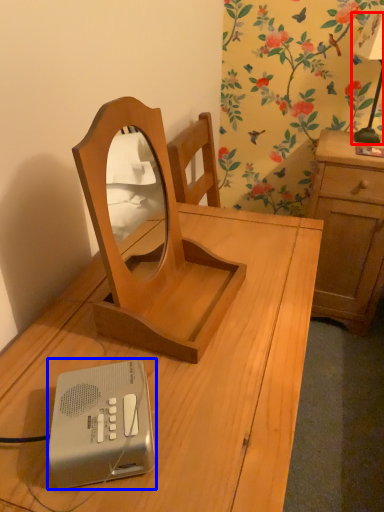
Question: Which of the following is the closest to the observer, bedside lamp (highlighted by a red box) or ipod (highlighted by a blue box)?

Choices:
 (A) bedside lamp
 (B) ipod

Answer: (B)